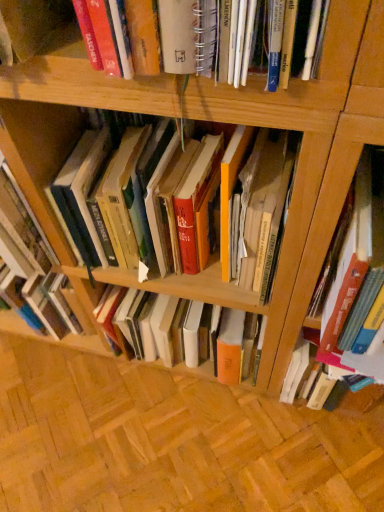
Looking at this image, measure the distance between point (379,153) and camera.

Point (379,153) and camera are 16.85 inches apart from each other.

What do you see at coordinates (320, 358) in the screenshot?
I see `hardcover book at right, the 1th book from the right` at bounding box center [320, 358].

You are a GUI agent. You are given a task and a screenshot of the screen. Output one action in this format:
    pyautogui.click(x=<x>, y=<y>)
    Task: Click on the hardcover book at right, which is the third book in left-to-right order
    
    Given the screenshot: What is the action you would take?
    pyautogui.click(x=320, y=358)

Where is `hardcover book at right, the second book viewed from the right`? The image size is (384, 512). hardcover book at right, the second book viewed from the right is located at coordinates (356, 247).

Is hardcover book at right, marked as the 2th book in a left-to-right arrangement, aimed at hardcover book at right, the 1th book from the right?

No, hardcover book at right, marked as the 2th book in a left-to-right arrangement, is not facing towards hardcover book at right, the 1th book from the right.

Which is in front, hardcover book at right, marked as the 2th book in a left-to-right arrangement, or hardcover book at right, which is the third book in left-to-right order?

Positioned in front is hardcover book at right, marked as the 2th book in a left-to-right arrangement.

From a real-world perspective, which object stands above the other?

From a 3D spatial view, hardcover book at right, the second book viewed from the right, is above.

Considering the relative sizes of hardcover book at right, marked as the 2th book in a left-to-right arrangement, and hardcover book at center, which appears as the third book when viewed from the right, in the image provided, is hardcover book at right, marked as the 2th book in a left-to-right arrangement, wider than hardcover book at center, which appears as the third book when viewed from the right,?

Yes, hardcover book at right, marked as the 2th book in a left-to-right arrangement, is wider than hardcover book at center, which appears as the third book when viewed from the right.

In the image, is hardcover book at right, the second book viewed from the right, positioned in front of or behind hardcover book at center, which appears as the third book when viewed from the right?

hardcover book at right, the second book viewed from the right, is in front of hardcover book at center, which appears as the third book when viewed from the right.

Is hardcover book at right, the second book viewed from the right, positioned beyond the bounds of hardcover book at center, which appears as the third book when viewed from the right?

hardcover book at right, the second book viewed from the right, is positioned outside hardcover book at center, which appears as the third book when viewed from the right.

Who is shorter, hardcover book at center, the first book from the left, or hardcover book at right, which is the third book in left-to-right order?

With less height is hardcover book at right, which is the third book in left-to-right order.

Considering the relative sizes of hardcover book at center, which appears as the third book when viewed from the right, and hardcover book at right, which is the third book in left-to-right order, in the image provided, is hardcover book at center, which appears as the third book when viewed from the right, smaller than hardcover book at right, which is the third book in left-to-right order,?

No, hardcover book at center, which appears as the third book when viewed from the right, is not smaller than hardcover book at right, which is the third book in left-to-right order.

Which is in front, hardcover book at center, which appears as the third book when viewed from the right, or hardcover book at right, the 1th book from the right?

hardcover book at center, which appears as the third book when viewed from the right.

How many degrees apart are the facing directions of hardcover book at center, the first book from the left, and hardcover book at right, the 1th book from the right?

The facing directions of hardcover book at center, the first book from the left, and hardcover book at right, the 1th book from the right, are 0.000487 degrees apart.

Can you tell me how much hardcover book at center, which appears as the third book when viewed from the right, and hardcover book at right, the second book viewed from the right, differ in facing direction?

The facing directions of hardcover book at center, which appears as the third book when viewed from the right, and hardcover book at right, the second book viewed from the right, are 0.000457 degrees apart.

Does hardcover book at center, the first book from the left, lie in front of hardcover book at right, marked as the 2th book in a left-to-right arrangement?

No, hardcover book at center, the first book from the left, is further to the viewer.

Considering the relative positions of hardcover book at center, the first book from the left, and hardcover book at right, marked as the 2th book in a left-to-right arrangement, in the image provided, is hardcover book at center, the first book from the left, to the left or to the right of hardcover book at right, marked as the 2th book in a left-to-right arrangement,?

hardcover book at center, the first book from the left, is to the left of hardcover book at right, marked as the 2th book in a left-to-right arrangement.

Looking at this image, from a real-world perspective, is hardcover book at center, the first book from the left, physically above hardcover book at right, marked as the 2th book in a left-to-right arrangement?

Correct, in the physical world, hardcover book at center, the first book from the left, is higher than hardcover book at right, marked as the 2th book in a left-to-right arrangement.

Is hardcover book at right, which is the third book in left-to-right order, positioned beyond the bounds of hardcover book at center, the first book from the left?

Absolutely, hardcover book at right, which is the third book in left-to-right order, is external to hardcover book at center, the first book from the left.

How different are the orientations of hardcover book at right, which is the third book in left-to-right order, and hardcover book at center, the first book from the left, in degrees?

They differ by 0.000487 degrees in their facing directions.

Is hardcover book at right, which is the third book in left-to-right order, wider than hardcover book at center, which appears as the third book when viewed from the right?

No, hardcover book at right, which is the third book in left-to-right order, is not wider than hardcover book at center, which appears as the third book when viewed from the right.

Which object is positioned more to the left, hardcover book at right, which is the third book in left-to-right order, or hardcover book at center, the first book from the left?

Positioned to the left is hardcover book at center, the first book from the left.

Is hardcover book at right, the second book viewed from the right, surrounded by hardcover book at right, the 1th book from the right?

No, hardcover book at right, the second book viewed from the right, is not inside hardcover book at right, the 1th book from the right.

Between hardcover book at right, which is the third book in left-to-right order, and hardcover book at right, the second book viewed from the right, which one has smaller width?

hardcover book at right, which is the third book in left-to-right order, is thinner.

Which book is the 2nd one when counting from the front of the hardcover book at right, which is the third book in left-to-right order? Please provide its 2D coordinates.

[(356, 247)]

Can you confirm if hardcover book at right, the 1th book from the right, is bigger than hardcover book at right, the second book viewed from the right?

Incorrect, hardcover book at right, the 1th book from the right, is not larger than hardcover book at right, the second book viewed from the right.

Where is `book on the right of hardcover book at right, marked as the 2th book in a left-to-right arrangement`? This screenshot has width=384, height=512. book on the right of hardcover book at right, marked as the 2th book in a left-to-right arrangement is located at coordinates (320, 358).

The width and height of the screenshot is (384, 512). I want to click on book that is the 1st one when counting downward from the hardcover book at center, the first book from the left (from the image's perspective), so click(x=356, y=247).

Estimate the real-world distances between objects in this image. Which object is closer to hardcover book at right, the 1th book from the right, hardcover book at center, the first book from the left, or hardcover book at right, the second book viewed from the right?

Based on the image, hardcover book at right, the second book viewed from the right, appears to be nearer to hardcover book at right, the 1th book from the right.

Consider the image. Which object lies nearer to the anchor point hardcover book at right, which is the third book in left-to-right order, hardcover book at right, the second book viewed from the right, or hardcover book at center, which appears as the third book when viewed from the right?

hardcover book at right, the second book viewed from the right, is positioned closer to the anchor hardcover book at right, which is the third book in left-to-right order.

Looking at the image, which one is located further to hardcover book at right, marked as the 2th book in a left-to-right arrangement, hardcover book at center, which appears as the third book when viewed from the right, or hardcover book at right, which is the third book in left-to-right order?

Among the two, hardcover book at center, which appears as the third book when viewed from the right, is located further to hardcover book at right, marked as the 2th book in a left-to-right arrangement.

Which object lies further to the anchor point hardcover book at center, which appears as the third book when viewed from the right, hardcover book at right, marked as the 2th book in a left-to-right arrangement, or hardcover book at right, the 1th book from the right?

Among the two, hardcover book at right, the 1th book from the right, is located further to hardcover book at center, which appears as the third book when viewed from the right.

Looking at the image, which one is located further to hardcover book at center, the first book from the left, hardcover book at right, which is the third book in left-to-right order, or hardcover book at right, marked as the 2th book in a left-to-right arrangement?

Among the two, hardcover book at right, which is the third book in left-to-right order, is located further to hardcover book at center, the first book from the left.

Considering their positions, is hardcover book at right, which is the third book in left-to-right order, positioned further to hardcover book at right, marked as the 2th book in a left-to-right arrangement, than hardcover book at center, which appears as the third book when viewed from the right?

hardcover book at center, which appears as the third book when viewed from the right.

Where is `book between hardcover book at center, the first book from the left, and hardcover book at right, the 1th book from the right, vertically`? This screenshot has height=512, width=384. book between hardcover book at center, the first book from the left, and hardcover book at right, the 1th book from the right, vertically is located at coordinates (356, 247).